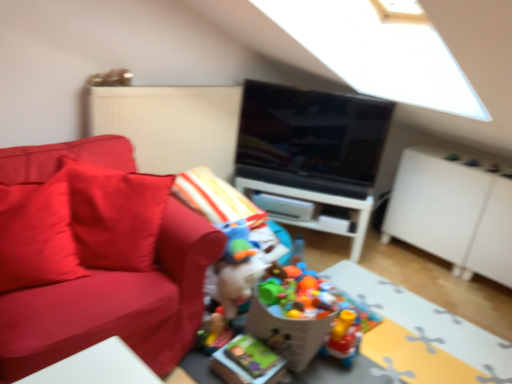
I want to click on free spot to the right of translucent plastic toy at center, arranged as the second toy when viewed from the front, so click(379, 350).